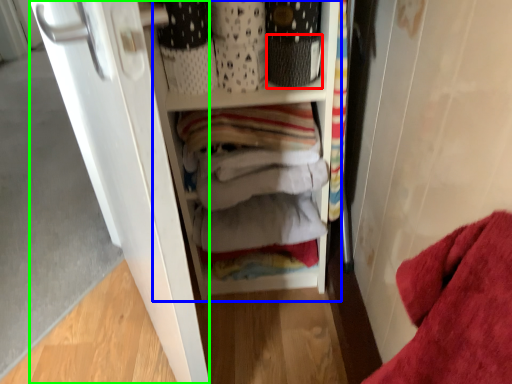
Question: Considering the real-world distances, which object is closest to basket (highlighted by a red box)? cabinetry (highlighted by a blue box) or door (highlighted by a green box).

Choices:
 (A) cabinetry
 (B) door

Answer: (A)